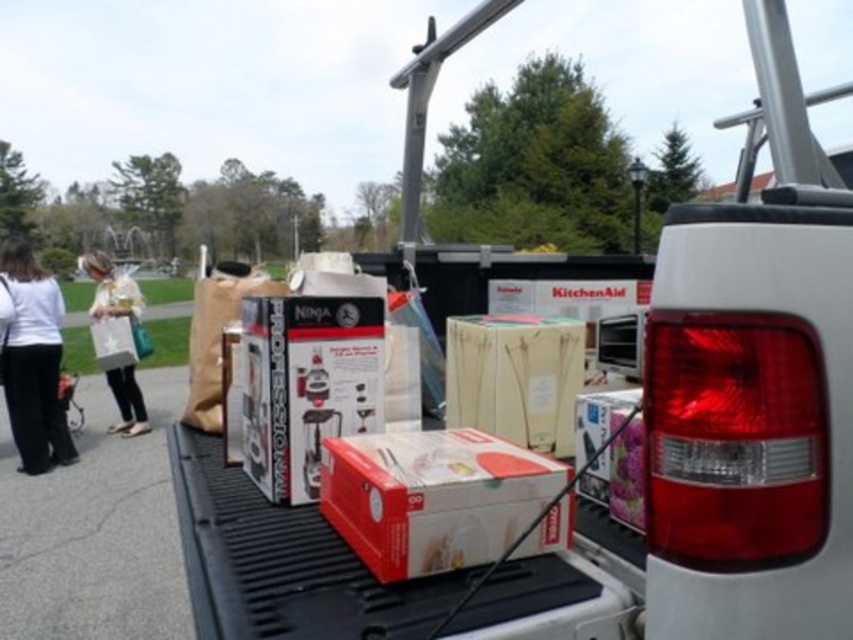
Question: Based on their relative distances, which object is nearer to the red matte cardboard box at center?

Choices:
 (A) white paper bag at left
 (B) white cotton shirt at left

Answer: (B)

Question: Does white cotton shirt at left have a larger size compared to white paper bag at left?

Choices:
 (A) no
 (B) yes

Answer: (A)

Question: Where is white cotton shirt at left located in relation to white paper bag at left in the image?

Choices:
 (A) right
 (B) left

Answer: (A)

Question: Which point appears farthest from the camera in this image?

Choices:
 (A) (113, 284)
 (B) (21, 273)

Answer: (A)

Question: Which object is the closest to the white cotton shirt at left?

Choices:
 (A) white paper bag at left
 (B) red matte cardboard box at center

Answer: (A)

Question: Does red matte cardboard box at center lie in front of white cotton shirt at left?

Choices:
 (A) yes
 (B) no

Answer: (A)